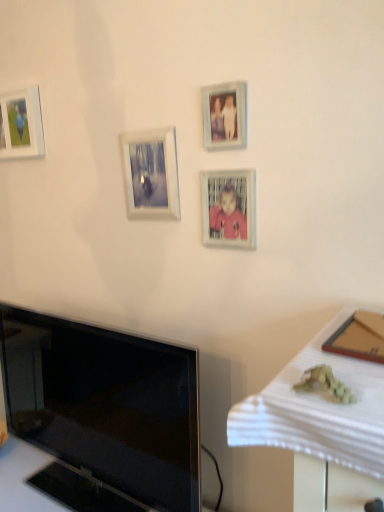
Question: Are matte white picture frame at upper left, acting as the 4th picture frame starting from the front, and matte plastic picture frame at center, which appears as the 2th picture frame when viewed from the front, making contact?

Choices:
 (A) yes
 (B) no

Answer: (B)

Question: From the image's perspective, is matte white picture frame at upper left, acting as the 4th picture frame starting from the front, on matte plastic picture frame at center, the first picture frame from the right?

Choices:
 (A) no
 (B) yes

Answer: (B)

Question: Considering the relative sizes of matte white picture frame at upper left, the 1th picture frame viewed from the back, and matte plastic picture frame at center, the first picture frame from the right, in the image provided, is matte white picture frame at upper left, the 1th picture frame viewed from the back, shorter than matte plastic picture frame at center, the first picture frame from the right,?

Choices:
 (A) yes
 (B) no

Answer: (B)

Question: From a real-world perspective, is matte white picture frame at upper left, the 1th picture frame positioned from the left, under matte plastic picture frame at center, which is the fourth picture frame in left-to-right order?

Choices:
 (A) no
 (B) yes

Answer: (A)

Question: Can matte plastic picture frame at center, which appears as the 2th picture frame when viewed from the front, be found inside matte white picture frame at upper left, acting as the 4th picture frame starting from the front?

Choices:
 (A) yes
 (B) no

Answer: (B)

Question: Is matte glass photo frame at upper center, the 3th picture frame in the right-to-left sequence, in front of or behind matte white picture frame at upper left, the 4th picture frame positioned from the right, in the image?

Choices:
 (A) front
 (B) behind

Answer: (A)

Question: From a real-world perspective, is matte glass photo frame at upper center, which ranks as the third picture frame in front-to-back order, positioned above or below matte white picture frame at upper left, acting as the 4th picture frame starting from the front?

Choices:
 (A) above
 (B) below

Answer: (B)

Question: Is matte glass photo frame at upper center, the 3th picture frame in the right-to-left sequence, situated inside matte white picture frame at upper left, acting as the 4th picture frame starting from the front, or outside?

Choices:
 (A) inside
 (B) outside

Answer: (B)

Question: From the image's perspective, is matte glass photo frame at upper center, marked as the 2th picture frame in a back-to-front arrangement, located above or below matte white picture frame at upper left, the 4th picture frame positioned from the right?

Choices:
 (A) below
 (B) above

Answer: (A)

Question: Is black glossy tv at lower left inside or outside of matte glass photo frame at upper center, marked as the 2th picture frame in a left-to-right arrangement?

Choices:
 (A) outside
 (B) inside

Answer: (A)

Question: In terms of height, does black glossy tv at lower left look taller or shorter compared to matte glass photo frame at upper center, marked as the 2th picture frame in a left-to-right arrangement?

Choices:
 (A) tall
 (B) short

Answer: (A)

Question: Based on their positions, is black glossy tv at lower left located to the left or right of matte glass photo frame at upper center, the 3th picture frame in the right-to-left sequence?

Choices:
 (A) left
 (B) right

Answer: (A)

Question: Is black glossy tv at lower left wider or thinner than matte glass photo frame at upper center, marked as the 2th picture frame in a left-to-right arrangement?

Choices:
 (A) thin
 (B) wide

Answer: (B)

Question: From the image's perspective, is matte plastic picture frame at center, which is counted as the third picture frame, starting from the back, above or below light blue wooden picture frame at upper center, acting as the 2th picture frame starting from the right?

Choices:
 (A) below
 (B) above

Answer: (A)

Question: From a real-world perspective, is matte plastic picture frame at center, which appears as the 2th picture frame when viewed from the front, above or below light blue wooden picture frame at upper center, acting as the 2th picture frame starting from the right?

Choices:
 (A) below
 (B) above

Answer: (A)